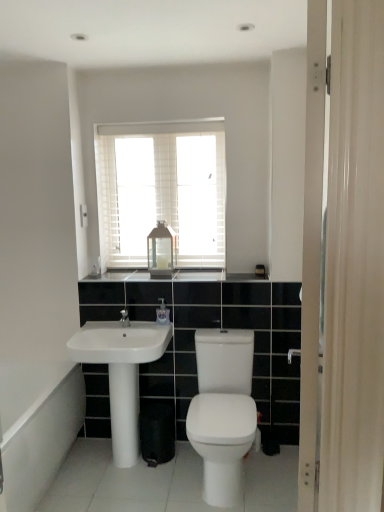
Locate an element on the screen. This screenshot has width=384, height=512. vacant region under white glossy bidet at center (from a real-world perspective) is located at coordinates (210, 488).